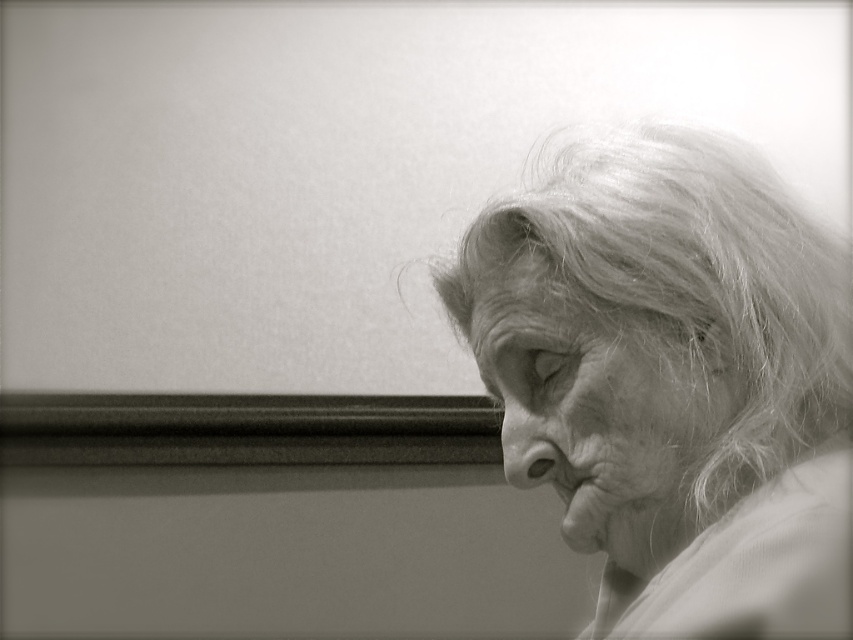
Based on the photo, does smooth skin face at center come in front of smooth skin mouth at lower right?

Yes, it is in front of smooth skin mouth at lower right.

The height and width of the screenshot is (640, 853). I want to click on smooth skin face at center, so click(596, 410).

Is point (674, 561) in front of point (575, 493)?

Yes, point (674, 561) is closer to viewer.

Can you confirm if smooth skin face at right is shorter than smooth skin mouth at lower right?

No.

Find the location of a particular element. The image size is (853, 640). smooth skin face at right is located at coordinates (666, 358).

Looking at this image, does smooth skin face at right have a larger size compared to smooth skin nose at center?

Indeed, smooth skin face at right has a larger size compared to smooth skin nose at center.

Can you confirm if smooth skin face at right is taller than smooth skin nose at center?

Yes, smooth skin face at right is taller than smooth skin nose at center.

Describe the element at coordinates (666, 358) in the screenshot. I see `smooth skin face at right` at that location.

What are the coordinates of `smooth skin face at right` in the screenshot? It's located at (666, 358).